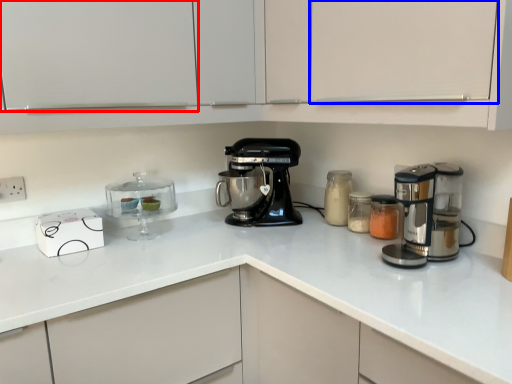
Question: Which point is further to the camera, cabinetry (highlighted by a red box) or cabinetry (highlighted by a blue box)?

Choices:
 (A) cabinetry
 (B) cabinetry

Answer: (A)